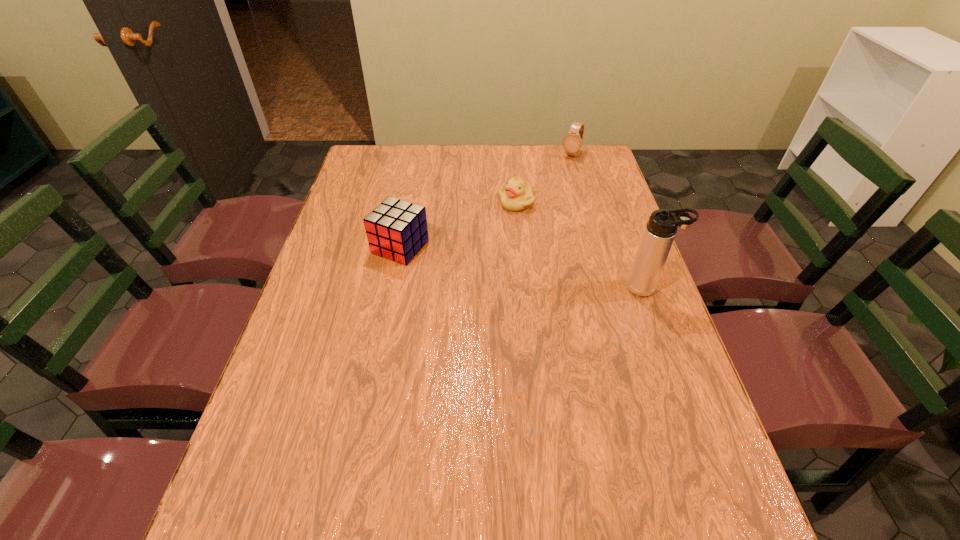
Locate an element on the screen. vacant spot on the desktop that is between the leftmost object and the thermos bottle and is positioned on the front-facing side of the shortest object is located at coordinates (496, 263).

The width and height of the screenshot is (960, 540). What are the coordinates of `free space on the desktop that is between the cube and the nearest object and is positioned on the face of the watch` in the screenshot? It's located at (490, 262).